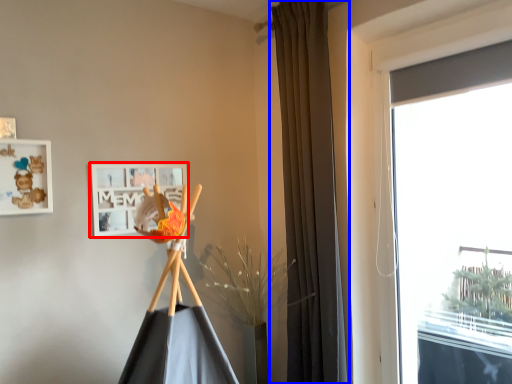
Question: Which object is further to the camera taking this photo, picture frame (highlighted by a red box) or curtain (highlighted by a blue box)?

Choices:
 (A) picture frame
 (B) curtain

Answer: (A)